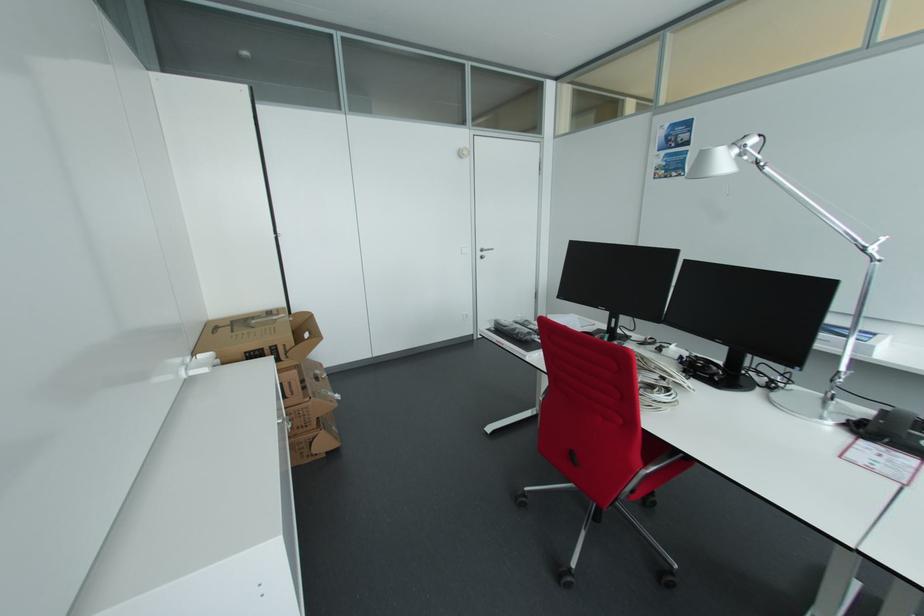
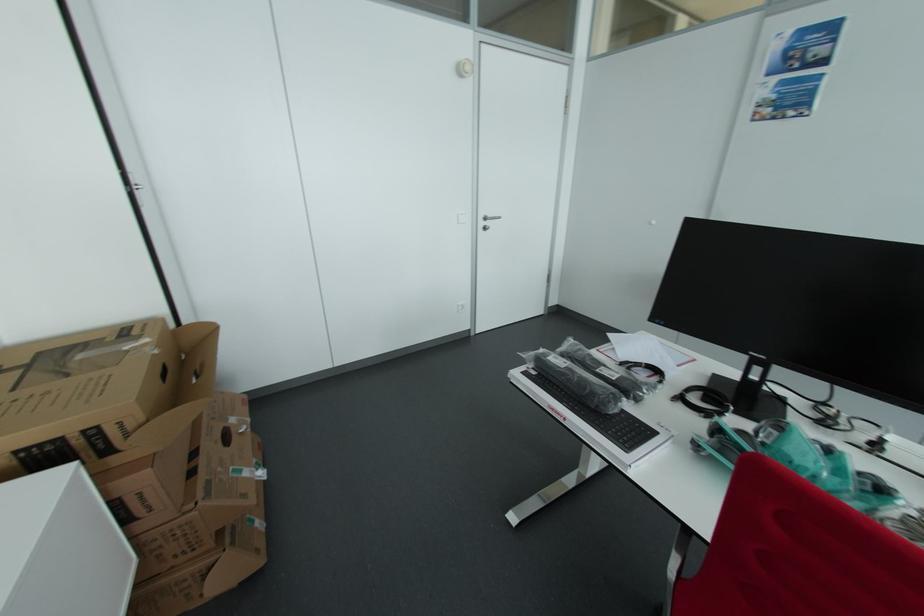
Where in the second image is the point corresponding to (x=488, y=249) from the first image?

(493, 216)